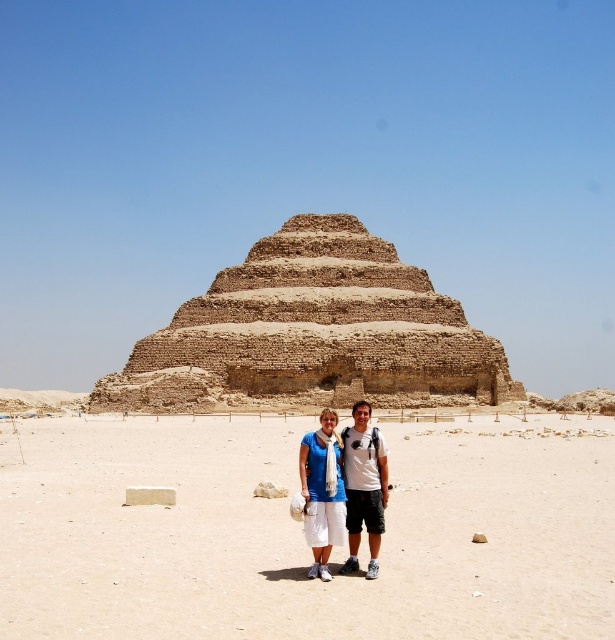
Does brown stone pyramid at center lie behind blue cotton shirt at center?

Yes, brown stone pyramid at center is further from the viewer.

Is brown stone pyramid at center smaller than blue cotton shirt at center?

No, brown stone pyramid at center is not smaller than blue cotton shirt at center.

What are the coordinates of `brown stone pyramid at center` in the screenshot? It's located at (314, 332).

In order to click on brown stone pyramid at center in this screenshot , I will do `click(314, 332)`.

Is beige sandy ground at center thinner than matte blue shirt at center?

Incorrect, beige sandy ground at center's width is not less than matte blue shirt at center's.

From the picture: Does beige sandy ground at center have a greater width compared to matte blue shirt at center?

Correct, the width of beige sandy ground at center exceeds that of matte blue shirt at center.

Which is in front, point (6, 560) or point (339, 502)?

Point (6, 560)

This screenshot has width=615, height=640. In order to click on beige sandy ground at center in this screenshot , I will do `click(301, 532)`.

Measure the distance from brown stone pyramid at center to matte blue shirt at center.

brown stone pyramid at center and matte blue shirt at center are 24.46 meters apart.

Which is in front, point (186, 307) or point (306, 438)?

Positioned in front is point (306, 438).

The height and width of the screenshot is (640, 615). What do you see at coordinates (314, 332) in the screenshot?
I see `brown stone pyramid at center` at bounding box center [314, 332].

This screenshot has width=615, height=640. I want to click on brown stone pyramid at center, so click(x=314, y=332).